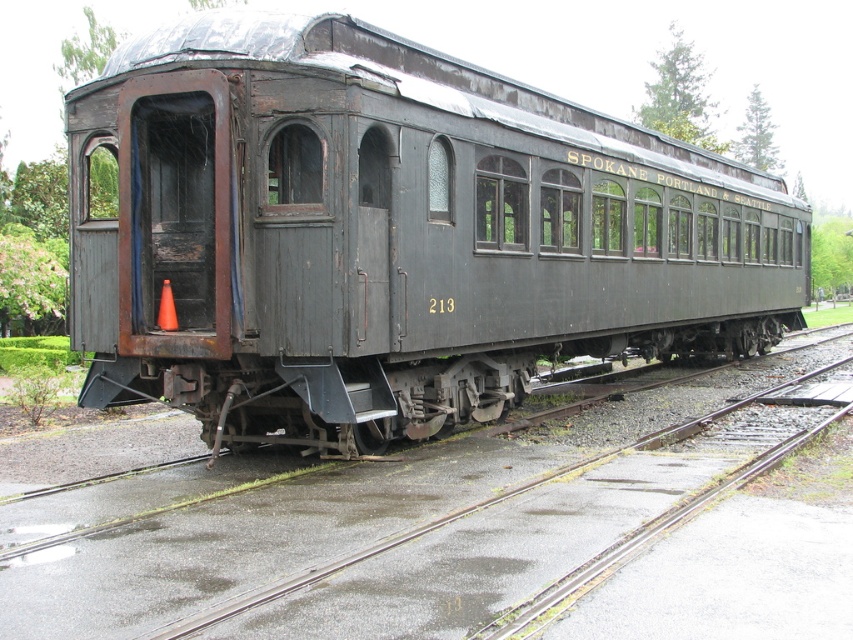
Question: Does rusty metal train car at center have a lesser width compared to rusty metal track at lower center?

Choices:
 (A) no
 (B) yes

Answer: (A)

Question: Is rusty metal train car at center wider than rusty metal track at lower center?

Choices:
 (A) yes
 (B) no

Answer: (A)

Question: Which of the following is the closest to the observer?

Choices:
 (A) (502, 300)
 (B) (109, 618)

Answer: (B)

Question: Among these points, which one is nearest to the camera?

Choices:
 (A) (688, 268)
 (B) (712, 586)

Answer: (B)

Question: Is rusty metal train car at center to the right of rusty metal track at lower center from the viewer's perspective?

Choices:
 (A) no
 (B) yes

Answer: (B)